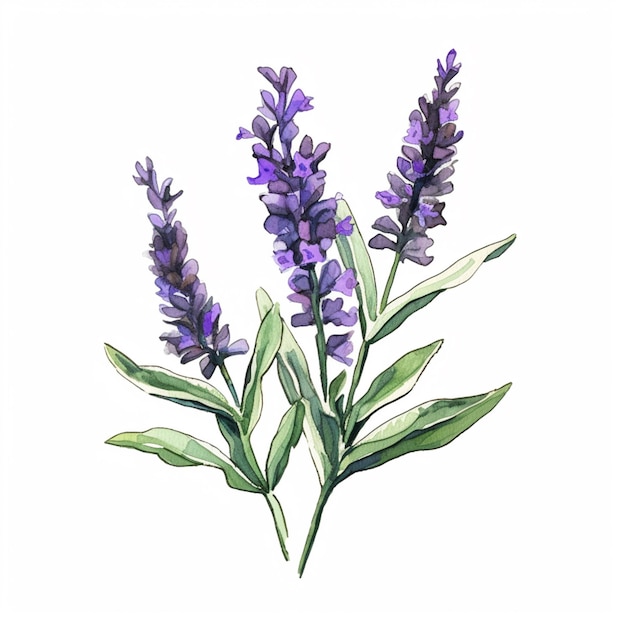
The image size is (626, 626). I want to click on left plant, so click(x=231, y=418).